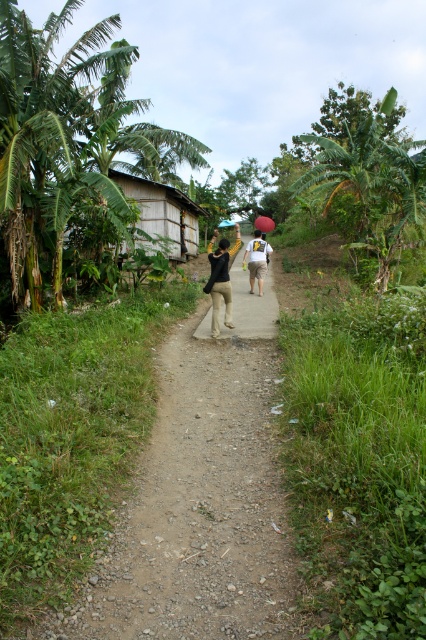
Is dirt path at center below black matte shirt at center?

Indeed, dirt path at center is positioned under black matte shirt at center.

Is point (186, 554) closer to camera compared to point (227, 269)?

Yes, point (186, 554) is in front of point (227, 269).

What are the coordinates of `dirt path at center` in the screenshot? It's located at (201, 497).

Which is more to the left, wooden hut at center or brown fabric bag at center?

wooden hut at center is more to the left.

Consider the image. Who is more distant from viewer, (123, 244) or (268, 337)?

Positioned behind is point (123, 244).

Where is `wooden hut at center`? The image size is (426, 640). wooden hut at center is located at coordinates (163, 216).

Which of these two, dirt path at center or brown fabric bag at center, stands shorter?

dirt path at center is shorter.

Which is behind, point (244, 547) or point (262, 324)?

Positioned behind is point (262, 324).

Is point (296, 573) positioned in front of point (233, 301)?

That is True.

You are a GUI agent. You are given a task and a screenshot of the screen. Output one action in this format:
    pyautogui.click(x=<x>, y=<y>)
    Task: Click on the dirt path at center
    This screenshot has width=426, height=640.
    Given the screenshot: What is the action you would take?
    pyautogui.click(x=201, y=497)